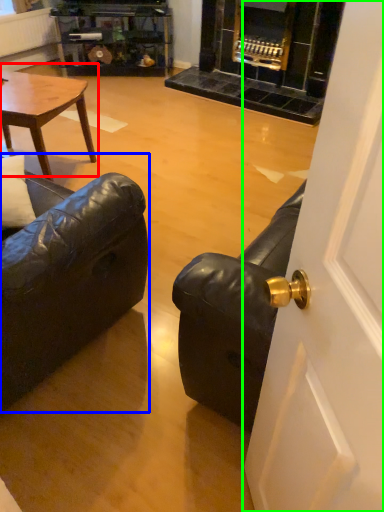
Question: Considering the real-world distances, which object is closest to coffee table (highlighted by a red box)? studio couch (highlighted by a blue box) or door (highlighted by a green box).

Choices:
 (A) studio couch
 (B) door

Answer: (A)